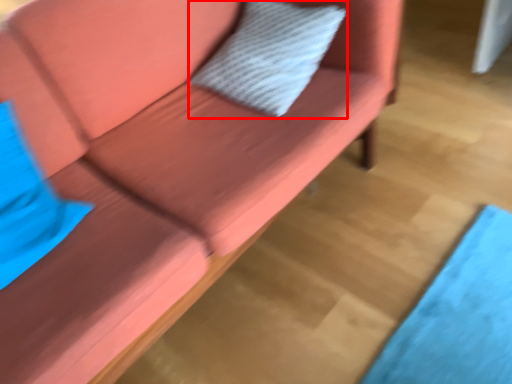
Question: From the image's perspective, where is pillow (annotated by the red box) located in relation to pillow in the image?

Choices:
 (A) above
 (B) below

Answer: (A)